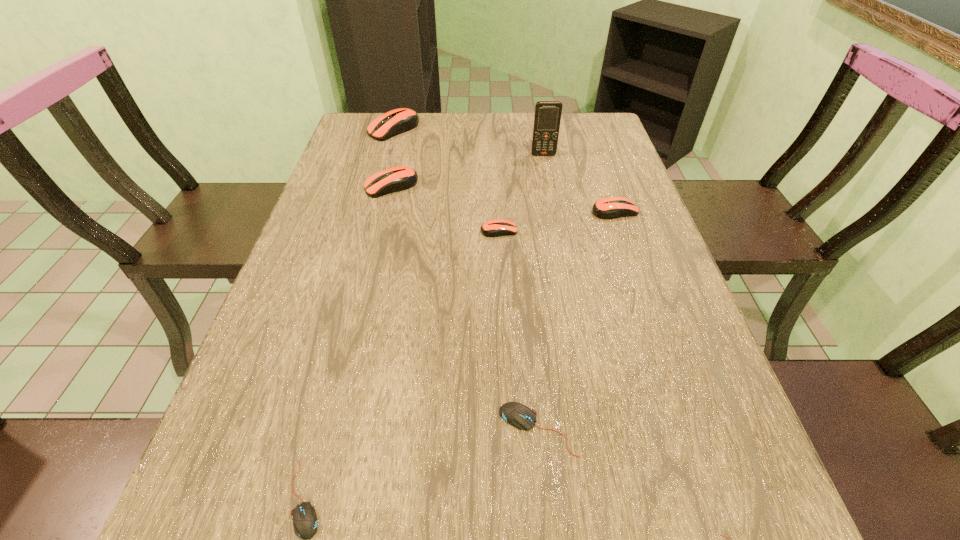
At what (x,y) coordinates should I click in order to perform the action: click on the second black mouse from right to left. Please return your answer as a coordinate pair (x, y). Image resolution: width=960 pixels, height=540 pixels. Looking at the image, I should click on (516, 414).

At what (x,y) coordinates should I click in order to perform the action: click on the fifth tallest mouse. Please return your answer as a coordinate pair (x, y). Looking at the image, I should click on (516, 414).

At what (x,y) coordinates should I click in order to perform the action: click on blank space located 0.330m on the screen of the tallest object. Please return your answer as a coordinate pair (x, y). Looking at the image, I should click on (557, 227).

The width and height of the screenshot is (960, 540). Identify the location of free space located 0.370m on the right of the second tallest object. (532, 129).

Identify the location of vacant space located 0.220m on the right of the second farthest mouse. (497, 186).

What are the coordinates of `free region located on the back of the fourth tallest object` in the screenshot? It's located at (597, 161).

This screenshot has height=540, width=960. I want to click on free space located on the right of the smallest orange computer mouse, so click(615, 231).

Locate an element on the screen. The image size is (960, 540). free region located 0.070m on the front of the biggest black mouse is located at coordinates (545, 505).

This screenshot has height=540, width=960. I want to click on object present at the far edge, so click(x=397, y=121).

Locate an element on the screen. The image size is (960, 540). object at the right edge is located at coordinates (607, 208).